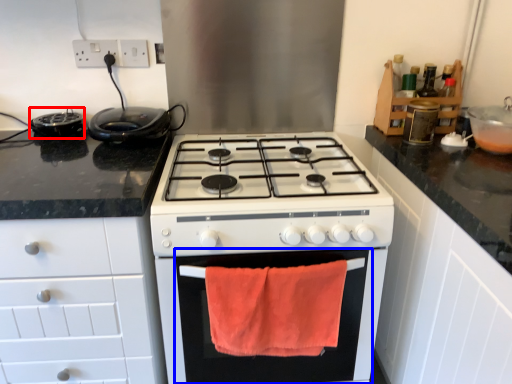
Question: Which object is further to the camera taking this photo, appliance (highlighted by a red box) or oven (highlighted by a blue box)?

Choices:
 (A) appliance
 (B) oven

Answer: (A)